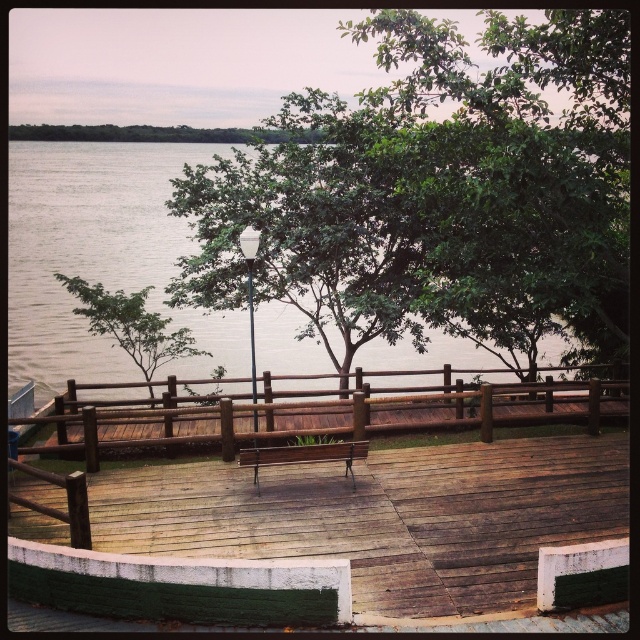
Question: Is wooden at center closer to camera compared to brown wooden rail at center?

Choices:
 (A) yes
 (B) no

Answer: (B)

Question: Is green leafy tree at center to the right of brown wooden rail at center from the viewer's perspective?

Choices:
 (A) no
 (B) yes

Answer: (B)

Question: Which object is the closest to the brown water at center?

Choices:
 (A) wooden bench at center
 (B) green leafy tree at upper center

Answer: (B)

Question: Among these points, which one is farthest from the camera?

Choices:
 (A) (60, 252)
 (B) (609, 435)
 (C) (116, 330)
 (D) (353, 416)

Answer: (A)

Question: Observing the image, what is the correct spatial positioning of brown wooden rail at center in reference to wooden bench at center?

Choices:
 (A) below
 (B) above

Answer: (B)

Question: Which point is closer to the camera taking this photo?

Choices:
 (A) (413, 596)
 (B) (275, 458)
 (C) (440, 49)
 (D) (275, 140)

Answer: (A)